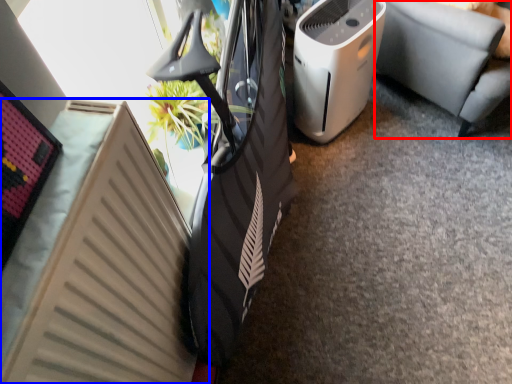
Question: Which of the following is the farthest to the observer, furniture (highlighted by a red box) or radiator (highlighted by a blue box)?

Choices:
 (A) furniture
 (B) radiator

Answer: (A)